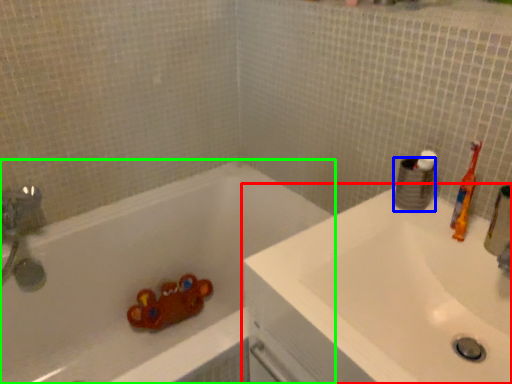
Question: Estimate the real-world distances between objects in this image. Which object is farther from sink (highlighted by a red box), toilet paper (highlighted by a blue box) or bathtub (highlighted by a green box)?

Choices:
 (A) toilet paper
 (B) bathtub

Answer: (B)